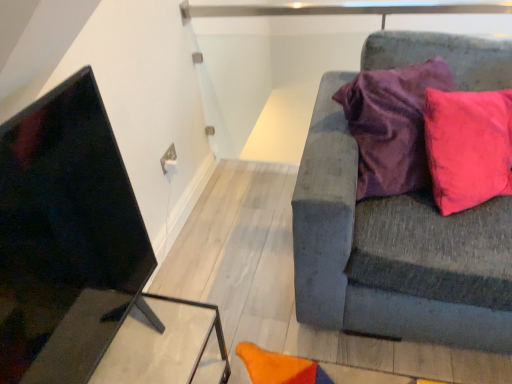
This screenshot has height=384, width=512. Describe the element at coordinates (394, 251) in the screenshot. I see `textured gray couch at right` at that location.

Measure the distance between textured gray couch at right and camera.

textured gray couch at right and camera are 3.96 feet apart.

The image size is (512, 384). I want to click on textured gray couch at right, so click(x=394, y=251).

The width and height of the screenshot is (512, 384). What do you see at coordinates (167, 346) in the screenshot?
I see `matte black table at lower left` at bounding box center [167, 346].

Where is `matte black table at lower left`? The height and width of the screenshot is (384, 512). matte black table at lower left is located at coordinates (167, 346).

You are a GUI agent. You are given a task and a screenshot of the screen. Output one action in this format:
    pyautogui.click(x=<x>, y=<y>)
    Task: Click on the textured gray couch at right
    Image resolution: width=512 pixels, height=384 pixels.
    Given the screenshot: What is the action you would take?
    pyautogui.click(x=394, y=251)

Does matte black table at lower left appear on the left side of textured gray couch at right?

Yes.

Is matte black table at lower left in front of or behind textured gray couch at right in the image?

Clearly, matte black table at lower left is behind textured gray couch at right.

Considering the positions of point (203, 342) and point (490, 340), is point (203, 342) closer or farther from the camera than point (490, 340)?

Clearly, point (203, 342) is closer to the camera than point (490, 340).

From the image's perspective, is matte black table at lower left located beneath textured gray couch at right?

Correct, matte black table at lower left appears lower than textured gray couch at right in the image.

From a real-world perspective, which is physically above, matte black table at lower left or textured gray couch at right?

textured gray couch at right, from a real-world perspective.

Is matte black table at lower left wider or thinner than textured gray couch at right?

Considering their sizes, matte black table at lower left looks slimmer than textured gray couch at right.

Considering the sizes of matte black table at lower left and textured gray couch at right in the image, is matte black table at lower left taller or shorter than textured gray couch at right?

Clearly, matte black table at lower left is shorter compared to textured gray couch at right.

Does matte black table at lower left have a larger size compared to textured gray couch at right?

Actually, matte black table at lower left might be smaller than textured gray couch at right.

Would you say matte black table at lower left contains textured gray couch at right?

No, textured gray couch at right is located outside of matte black table at lower left.

Would you consider matte black table at lower left to be distant from textured gray couch at right?

No, matte black table at lower left is not far from textured gray couch at right.

Is matte black table at lower left aimed at textured gray couch at right?

No, matte black table at lower left is not oriented towards textured gray couch at right.

Find the location of a particular element. studio couch that appears above the matte black table at lower left (from the image's perspective) is located at coordinates (394, 251).

Is textured gray couch at right at the right side of matte black table at lower left?

Yes.

Does textured gray couch at right come behind matte black table at lower left?

No, it is not.

Does point (325, 128) come closer to viewer compared to point (197, 371)?

No, it is behind (197, 371).

From the image's perspective, which is below, textured gray couch at right or matte black table at lower left?

matte black table at lower left appears lower in the image.

From a real-world perspective, between textured gray couch at right and matte black table at lower left, who is vertically higher?

textured gray couch at right, from a real-world perspective.

In terms of width, does textured gray couch at right look wider or thinner when compared to matte black table at lower left?

textured gray couch at right is wider than matte black table at lower left.

Is textured gray couch at right taller than matte black table at lower left?

Indeed, textured gray couch at right has a greater height compared to matte black table at lower left.

Between textured gray couch at right and matte black table at lower left, which one has smaller size?

With smaller size is matte black table at lower left.

Which is correct: textured gray couch at right is inside matte black table at lower left, or outside of it?

textured gray couch at right is located beyond the bounds of matte black table at lower left.

Would you consider textured gray couch at right to be distant from matte black table at lower left?

textured gray couch at right is near matte black table at lower left, not far away.

Is textured gray couch at right facing towards matte black table at lower left?

No, textured gray couch at right is not aimed at matte black table at lower left.

What's the angular difference between textured gray couch at right and matte black table at lower left's facing directions?

textured gray couch at right and matte black table at lower left are facing 87.1 degrees away from each other.

Measure the distance from textured gray couch at right to matte black table at lower left.

They are 66.61 centimeters apart.

Locate an element on the screen. The width and height of the screenshot is (512, 384). studio couch above the matte black table at lower left (from the image's perspective) is located at coordinates (394, 251).

I want to click on table that appears below the textured gray couch at right (from the image's perspective), so click(167, 346).

This screenshot has width=512, height=384. I want to click on table behind the textured gray couch at right, so (x=167, y=346).